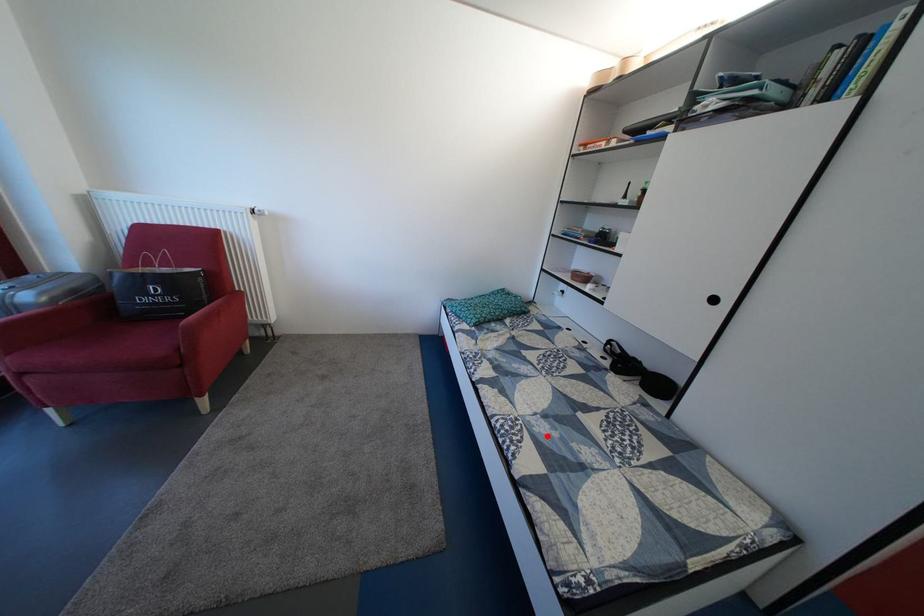
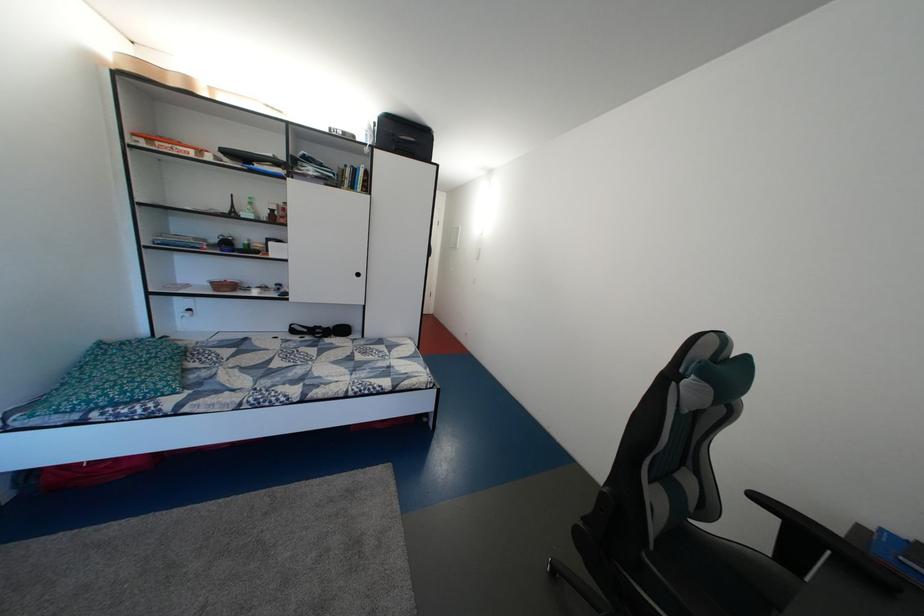
Locate, in the second image, the point that corresponds to the highlighted location in the first image.

(373, 382)